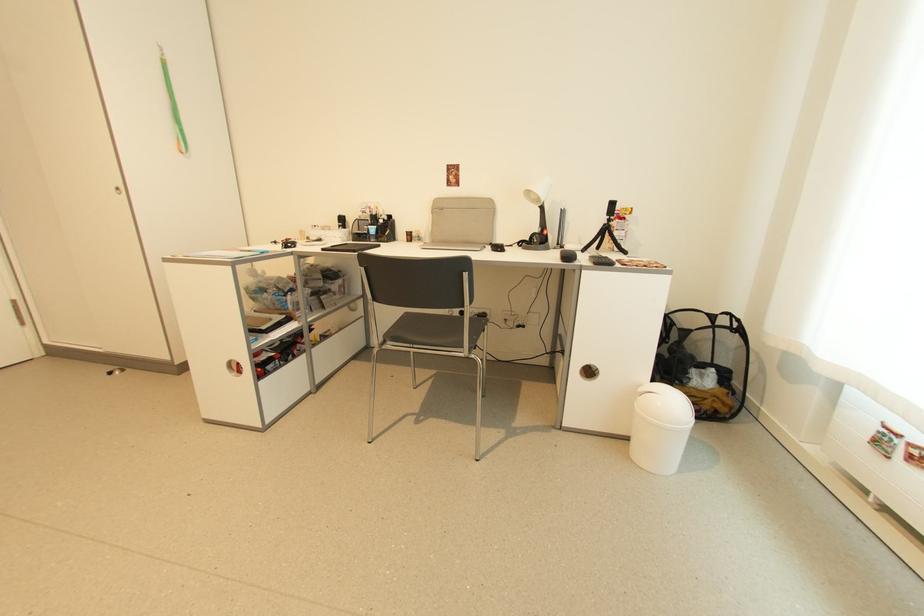
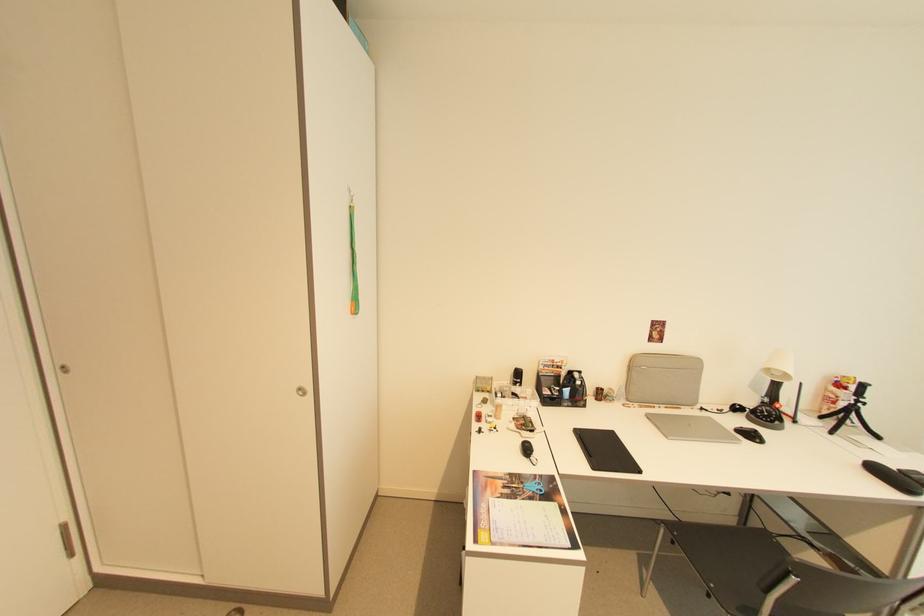
In the second image, find the point that corresponds to point (444, 211) in the first image.

(638, 366)